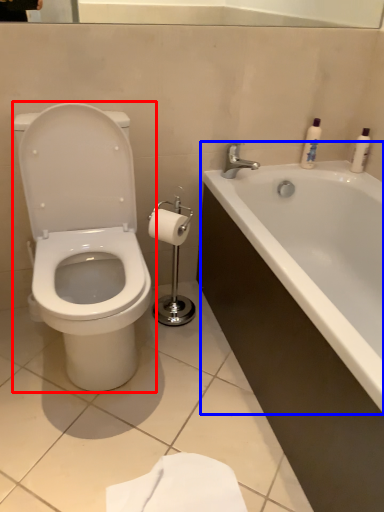
Question: Which object is closer to the camera taking this photo, toilet (highlighted by a red box) or bathtub (highlighted by a blue box)?

Choices:
 (A) toilet
 (B) bathtub

Answer: (B)